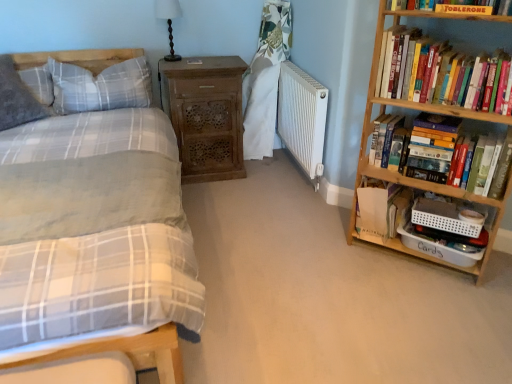
Locate an element on the screen. vacant area that lies in front of wooden bookshelf at right is located at coordinates (433, 309).